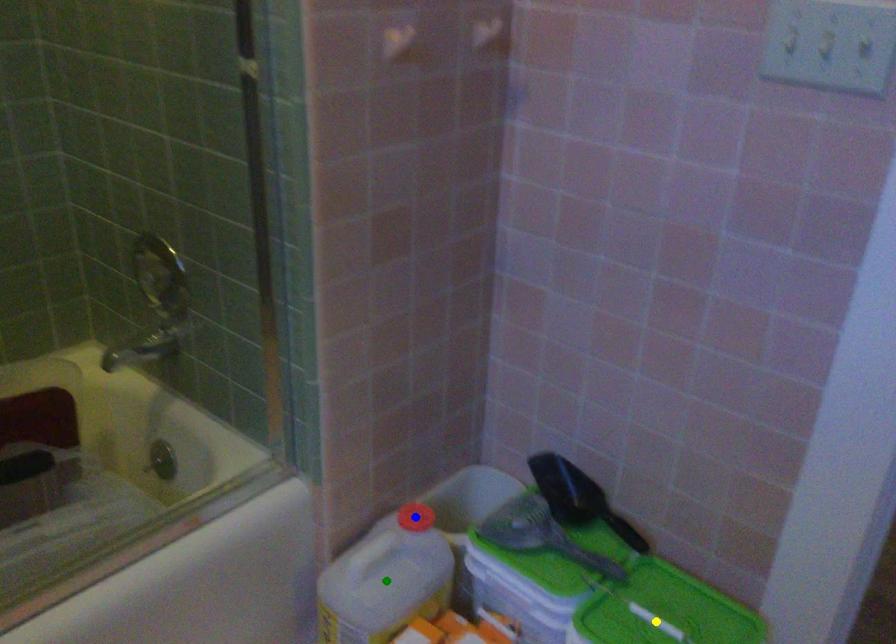
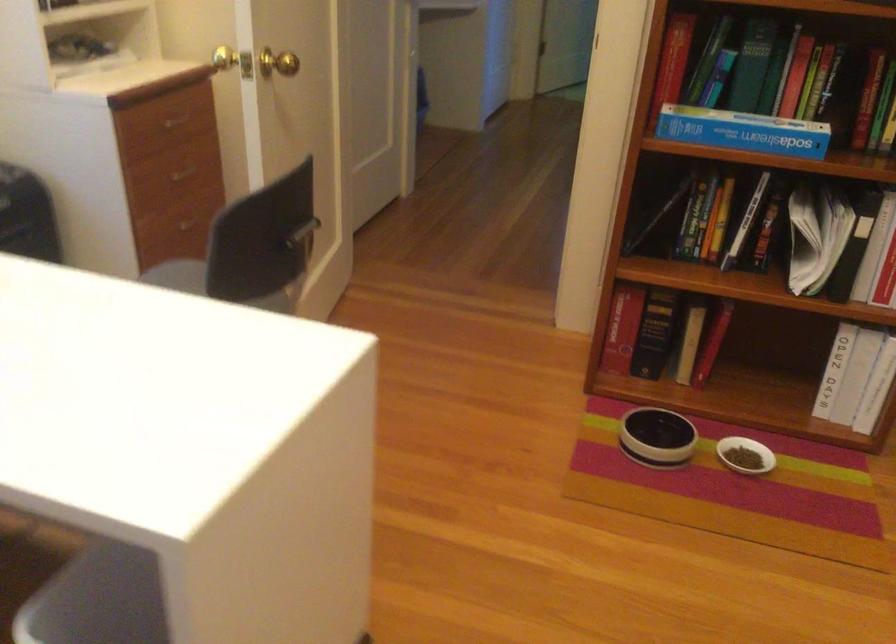
I am providing you with two images of the same scene from different viewpoints. Three points are marked in image1. Which point corresponds to a part or object that is occluded in image2?In image1, three points are marked. Which of them correspond to a part or object that is occluded in image2?Among the three points shown in image1, which one corresponds to a part or object that is no longer visible due to occlusion in image2?

green point, yellow point, blue point